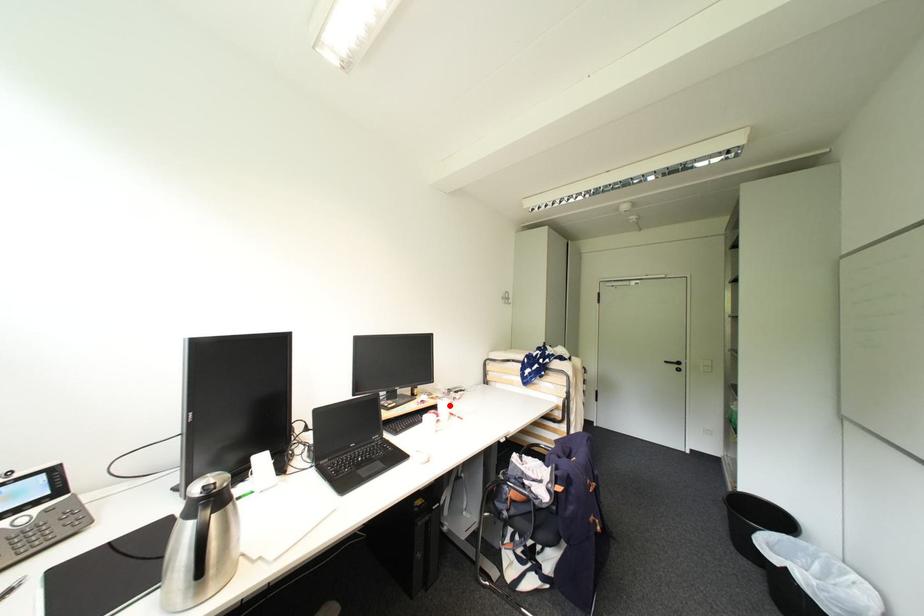
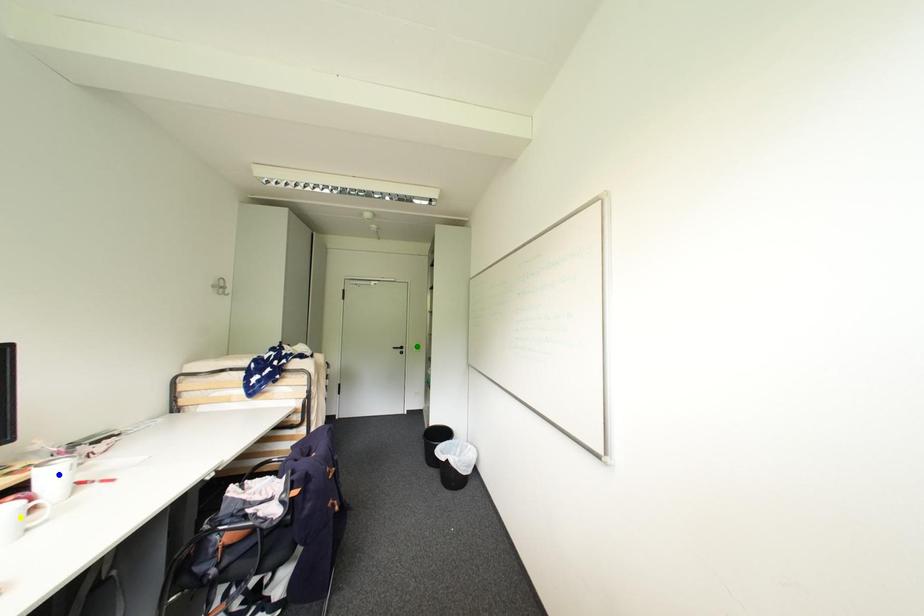
Question: I am providing you with two images of the same scene from different viewpoints. A red point is marked on the first image. You are given multiple points on the second image. Which mark in image 2 goes with the point in image 1?

Choices:
 (A) green point
 (B) yellow point
 (C) blue point

Answer: (C)